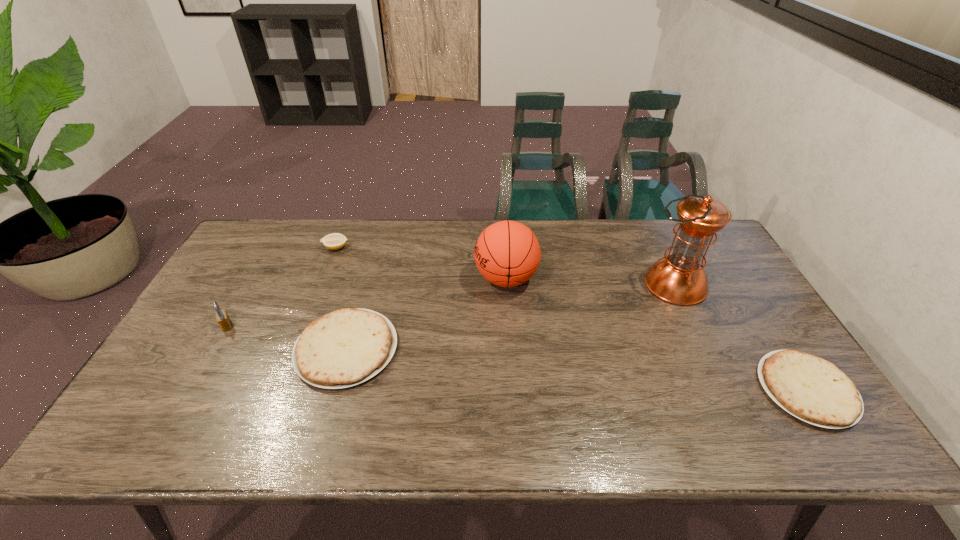
Please point a spot to place another tortilla for symmetrical spacing. Please provide its 2D coordinates. Your answer should be formatted as a tuple, i.e. [(x, y)], where the tuple contains the x and y coordinates of a point satisfying the conditions above.

[(567, 368)]